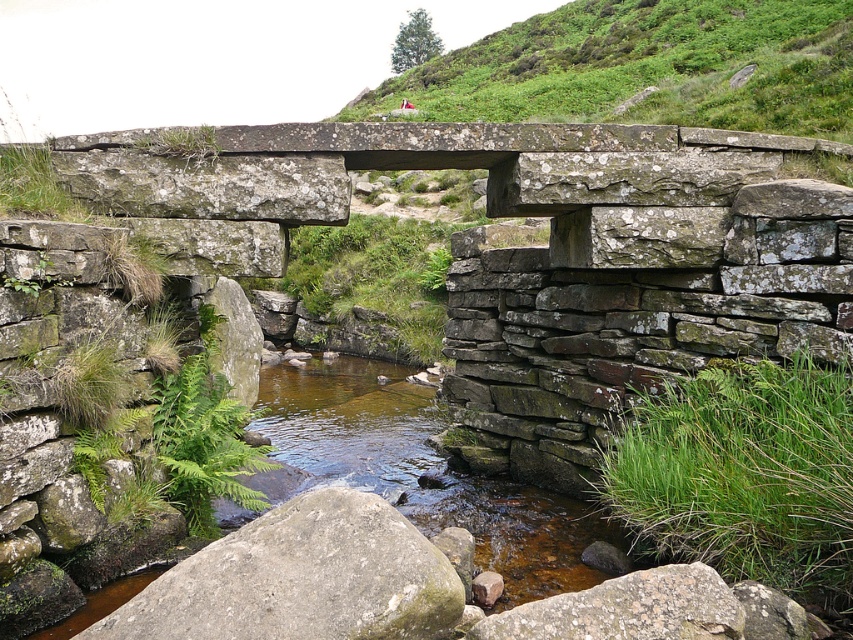
Does point (810, 61) come closer to viewer compared to point (236, 529)?

That is False.

In the scene shown: Is green grassy hillside at upper center to the right of gray rough rock at center from the viewer's perspective?

Yes, green grassy hillside at upper center is to the right of gray rough rock at center.

Is point (527, 45) in front of point (252, 586)?

No, (527, 45) is behind (252, 586).

Where is `green grassy hillside at upper center`? green grassy hillside at upper center is located at coordinates (646, 67).